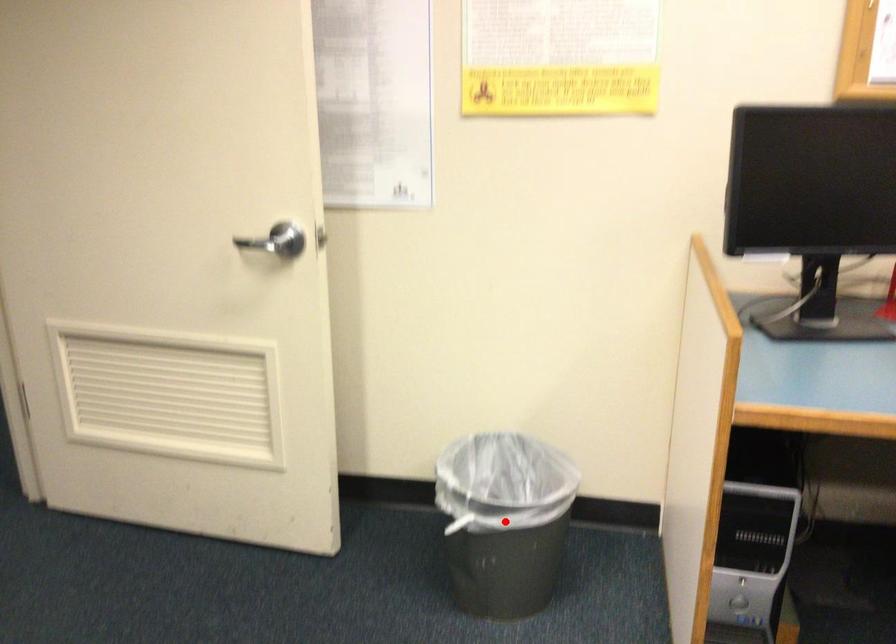
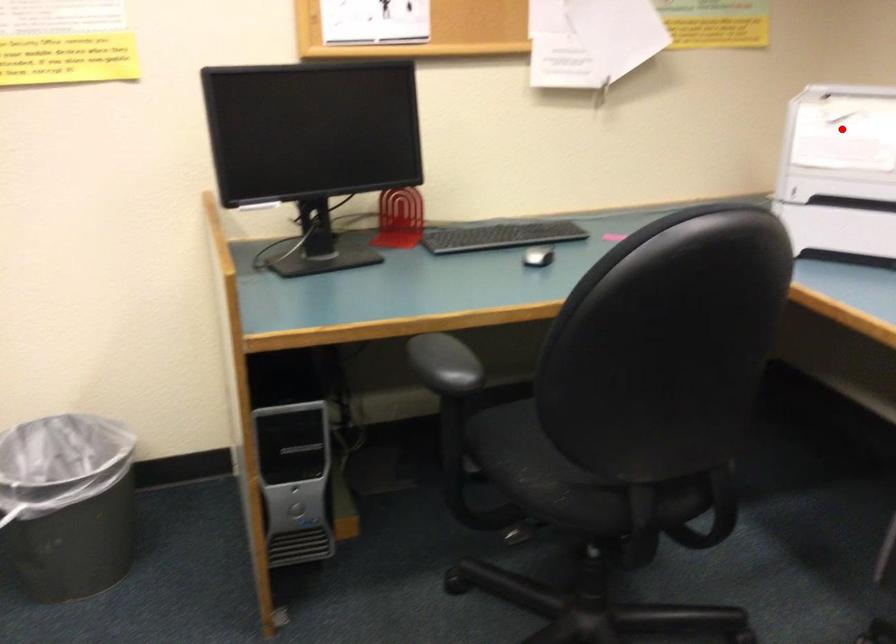
I am providing you with two images of the same scene from different viewpoints. A red point is marked on the first image and another point is marked on the second image. Are the points marked in image1 and image2 representing the same 3D position?

No